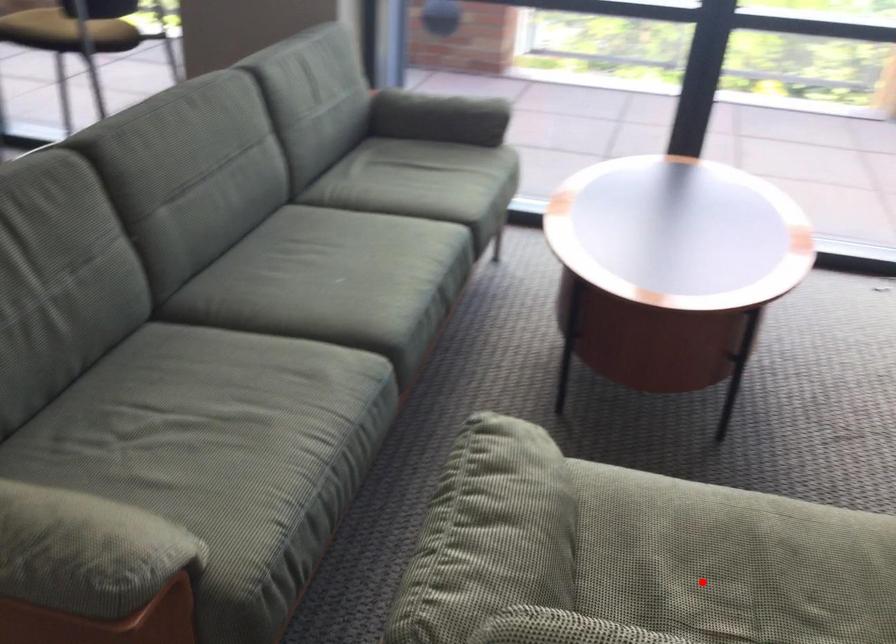
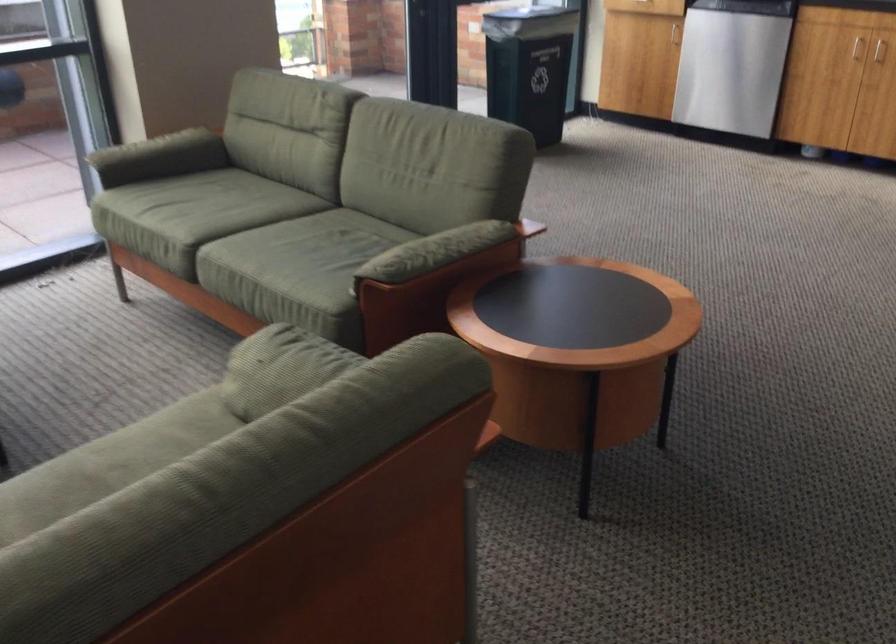
Question: I am providing you with two images of the same scene from different viewpoints. A red point is marked on the first image. Can you still see the location of the red point in image 2?

Choices:
 (A) Yes
 (B) No

Answer: (B)